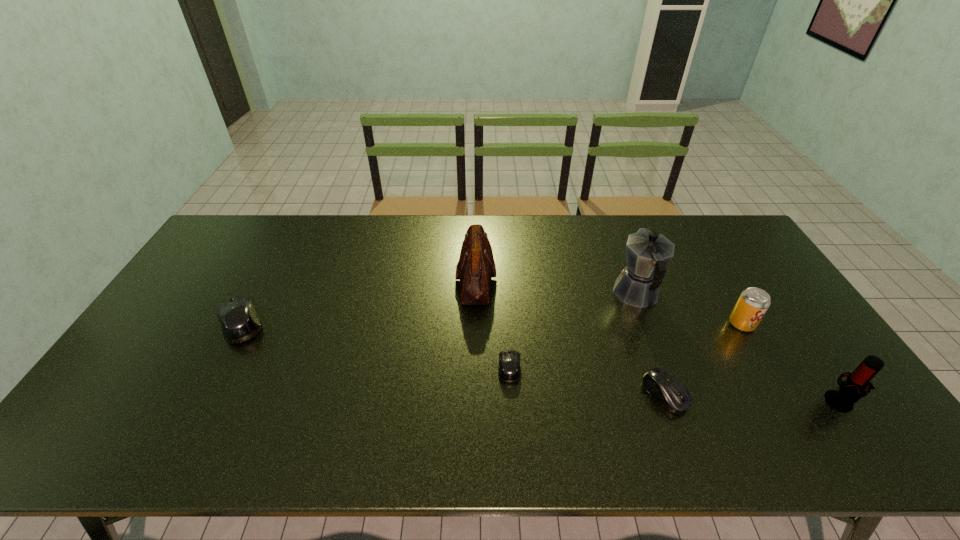
Find the location of `free space located on the left of the rightmost object`. free space located on the left of the rightmost object is located at coordinates coord(765,401).

Find the location of `object at the far edge`. object at the far edge is located at coordinates (476, 266).

You are a GUI agent. You are given a task and a screenshot of the screen. Output one action in this format:
    pyautogui.click(x=<x>, y=<y>)
    Task: Click on the microphone located in the near edge section of the desktop
    
    Given the screenshot: What is the action you would take?
    pyautogui.click(x=850, y=391)

Find the location of a particular element. pop (soda) at the right edge is located at coordinates (753, 303).

Find the location of `microphone at the right edge`. microphone at the right edge is located at coordinates (850, 391).

At what (x,y) coordinates should I click in order to perform the action: click on object located at the near right corner. Please return your answer as a coordinate pair (x, y). The image size is (960, 540). Looking at the image, I should click on (850, 391).

The height and width of the screenshot is (540, 960). In the image, there is a desktop. In order to click on vacant area at the far edge in this screenshot , I will do `click(336, 218)`.

In the image, there is a desktop. Identify the location of vacant region at the near edge. Image resolution: width=960 pixels, height=540 pixels. [642, 408].

You are a GUI agent. You are given a task and a screenshot of the screen. Output one action in this format:
    pyautogui.click(x=<x>, y=<y>)
    Task: Click on the vacant area at the left edge
    
    Given the screenshot: What is the action you would take?
    pyautogui.click(x=197, y=293)

Locate an element on the screen. This screenshot has width=960, height=540. vacant space at the right edge of the desktop is located at coordinates (749, 255).